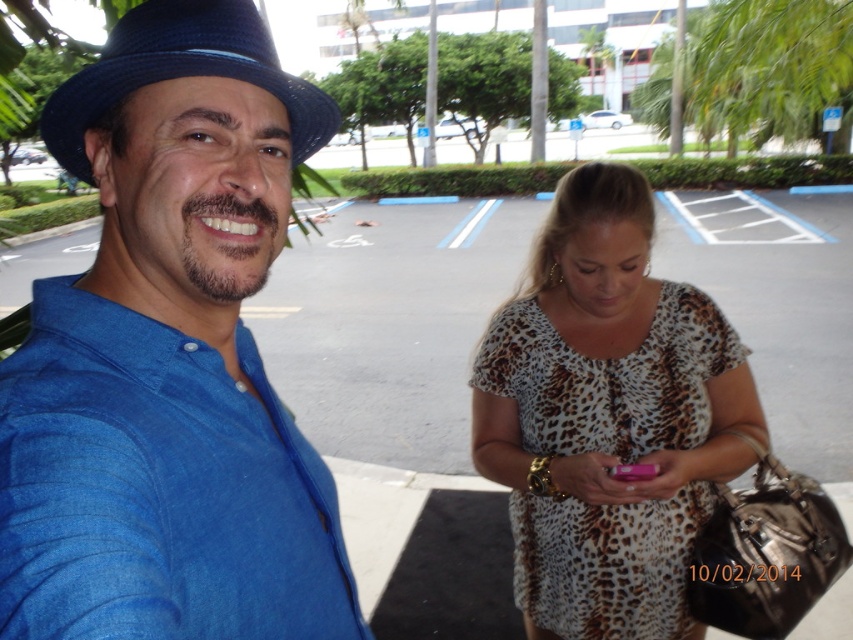
You are standing in the parking lot scene described. You need to determine which of the two points, point (323, 572) or point (548, 406), is nearer to you. Which one is closer?

Point (323, 572) is closer to the viewer than point (548, 406).

You are standing in a parking lot and see a man in a blue linen shirt at left and a blue fabric fedora at upper left. Which object is taller?

The blue linen shirt at left is much taller than the blue fabric fedora at upper left.